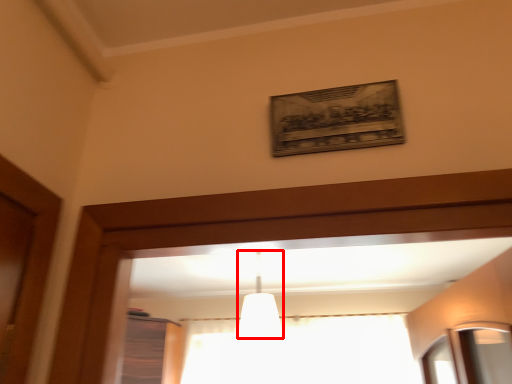
Question: Considering the relative positions of fixture (annotated by the red box) and curtain in the image provided, where is fixture (annotated by the red box) located with respect to the staircase?

Choices:
 (A) right
 (B) left

Answer: (B)